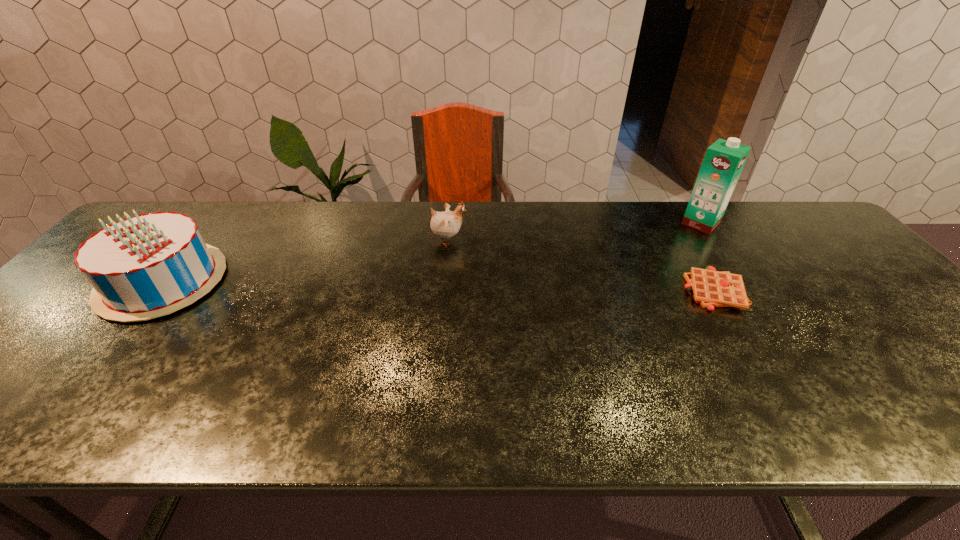
At what (x,y) coordinates should I click in order to perform the action: click on the tallest object. Please return your answer as a coordinate pair (x, y). Image resolution: width=960 pixels, height=540 pixels. Looking at the image, I should click on (724, 160).

I want to click on the leftmost object, so click(143, 267).

The height and width of the screenshot is (540, 960). I want to click on the second tallest object, so click(143, 267).

Locate an element on the screen. The image size is (960, 540). the second object from left to right is located at coordinates (444, 225).

Identify the location of the second shortest object. (444, 225).

At what (x,y) coordinates should I click in order to perform the action: click on waffle. Please return your answer as a coordinate pair (x, y). This screenshot has height=540, width=960. Looking at the image, I should click on (711, 288).

The height and width of the screenshot is (540, 960). In order to click on vacant area located on the right of the tallest object in this screenshot , I will do `click(772, 223)`.

Where is `free location located on the back of the birthday cake`? free location located on the back of the birthday cake is located at coordinates (225, 205).

Find the location of a particular element. vacant space located 0.190m at the beak of the bird is located at coordinates (531, 240).

Find the location of a particular element. vacant space located on the front of the waffle is located at coordinates (775, 393).